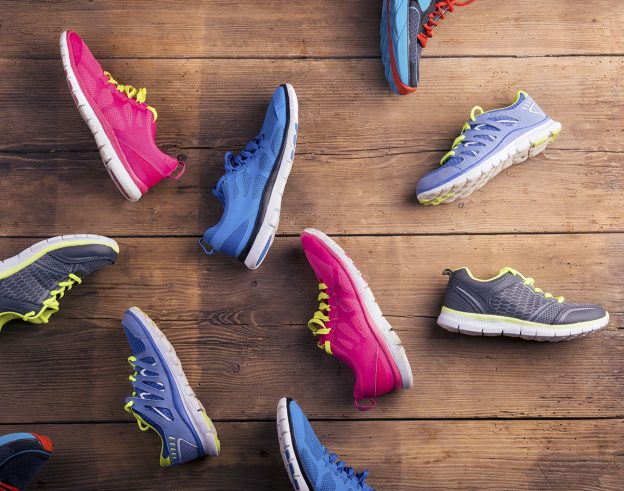
I want to click on wood board, so click(x=329, y=33), click(x=363, y=118), click(x=409, y=278), click(x=461, y=454).